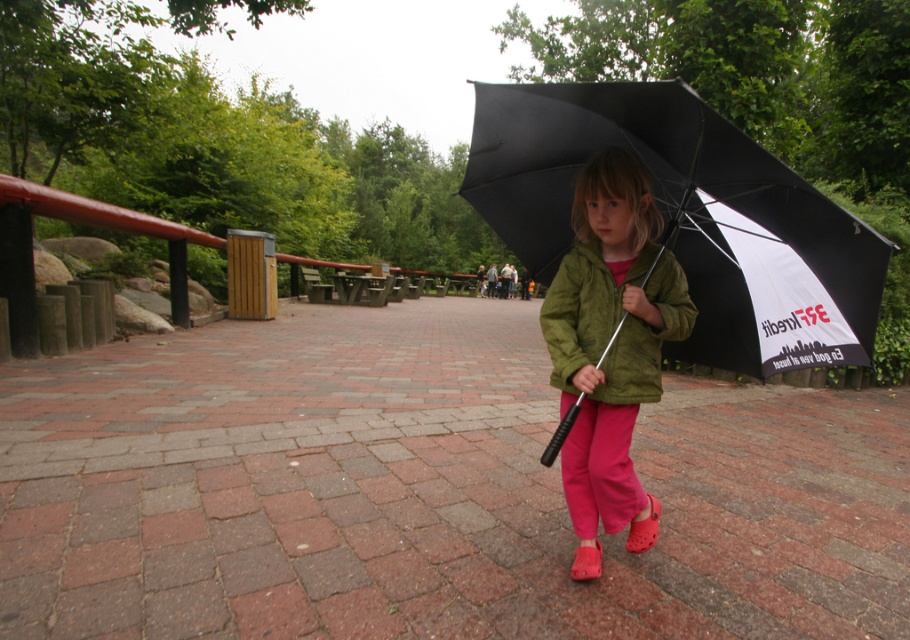
From the picture: Which is above, black matte umbrella at center or green suede jacket at center?

Positioned higher is black matte umbrella at center.

Does black matte umbrella at center appear on the right side of green suede jacket at center?

Indeed, black matte umbrella at center is positioned on the right side of green suede jacket at center.

Where is `black matte umbrella at center`? black matte umbrella at center is located at coordinates (686, 216).

From the picture: Is matte green jacket at center shorter than green suede jacket at center?

No, matte green jacket at center is not shorter than green suede jacket at center.

What are the coordinates of `matte green jacket at center` in the screenshot? It's located at (610, 348).

Locate an element on the screen. The image size is (910, 640). matte green jacket at center is located at coordinates (610, 348).

Locate an element on the screen. Image resolution: width=910 pixels, height=640 pixels. black matte umbrella at center is located at coordinates (686, 216).

Between black matte umbrella at center and matte green jacket at center, which one appears on the left side from the viewer's perspective?

matte green jacket at center

Does point (814, 195) lie behind point (592, 384)?

That is False.

Find the location of `black matte umbrella at center`. black matte umbrella at center is located at coordinates point(686,216).